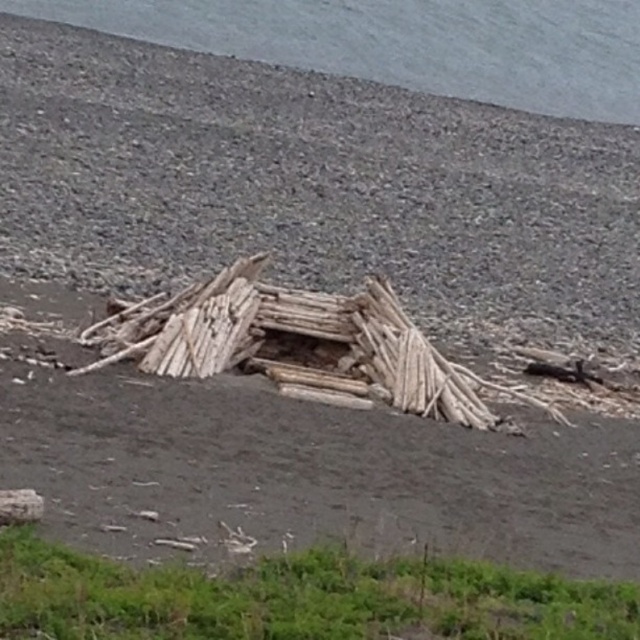
Can you confirm if natural wood shelter at center is smaller than gray water at upper center?

Yes.

At what (x,y) coordinates should I click in order to perform the action: click on natural wood shelter at center. Please return your answer as a coordinate pair (x, y). The width and height of the screenshot is (640, 640). Looking at the image, I should click on [312, 474].

Who is positioned more to the left, gray water at upper center or natural wood driftwood at center?

natural wood driftwood at center is more to the left.

Which is in front, point (369, 22) or point (189, 320)?

Point (189, 320) is more forward.

The height and width of the screenshot is (640, 640). What do you see at coordinates (404, 44) in the screenshot?
I see `gray water at upper center` at bounding box center [404, 44].

This screenshot has width=640, height=640. Identify the location of gray water at upper center. (404, 44).

Which of these two, natural wood shelter at center or natural wood driftwood at center, stands taller?

Standing taller between the two is natural wood driftwood at center.

Can you confirm if natural wood shelter at center is positioned above natural wood driftwood at center?

Actually, natural wood shelter at center is below natural wood driftwood at center.

Find the location of `natural wood shelter at center`. natural wood shelter at center is located at coordinates (312, 474).

Locate an element on the screen. The image size is (640, 640). natural wood shelter at center is located at coordinates (312, 474).